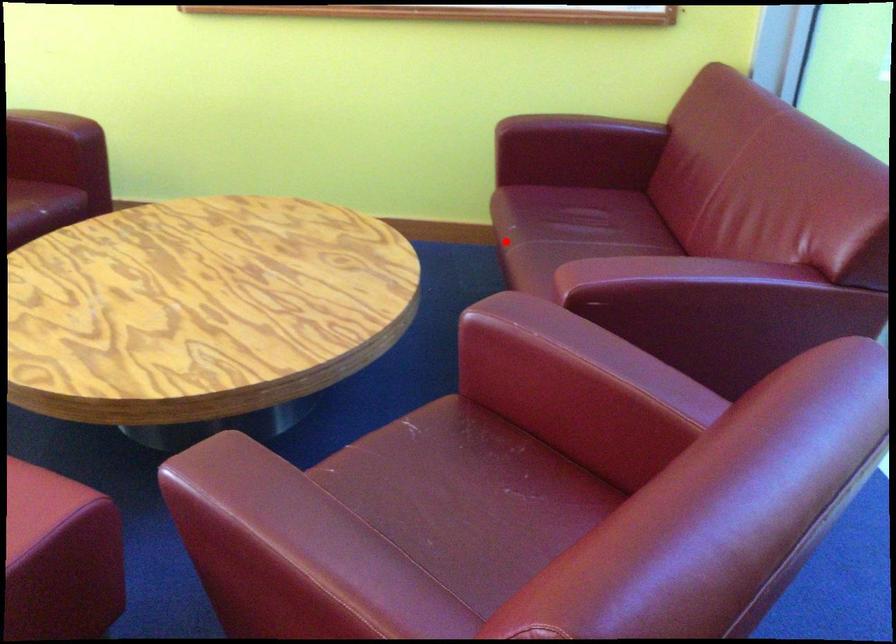
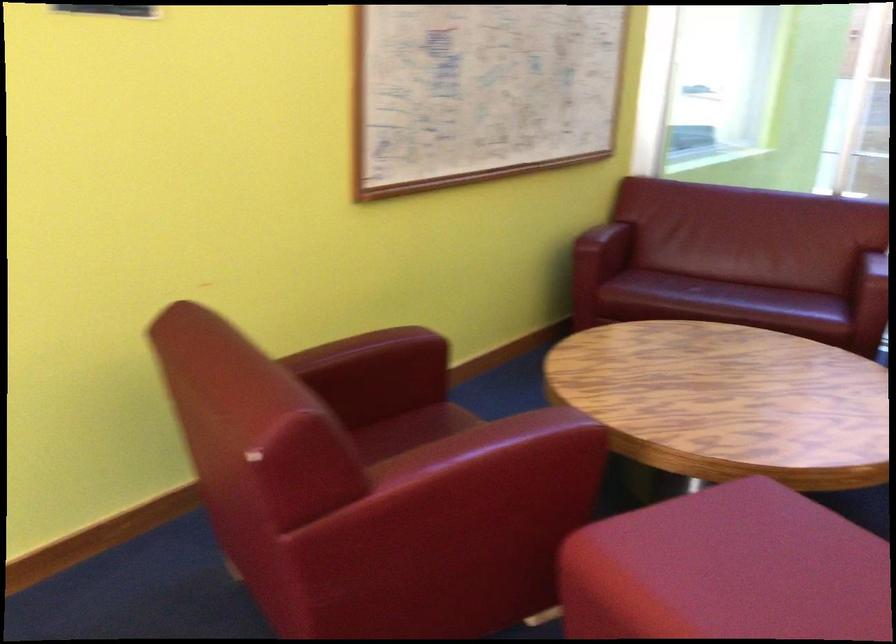
Question: I am providing you with two images of the same scene from different viewpoints. Given a red point in image1, look at the same physical point in image2. Is it:

Choices:
 (A) Closer to the viewpoint
 (B) Farther from the viewpoint

Answer: (B)